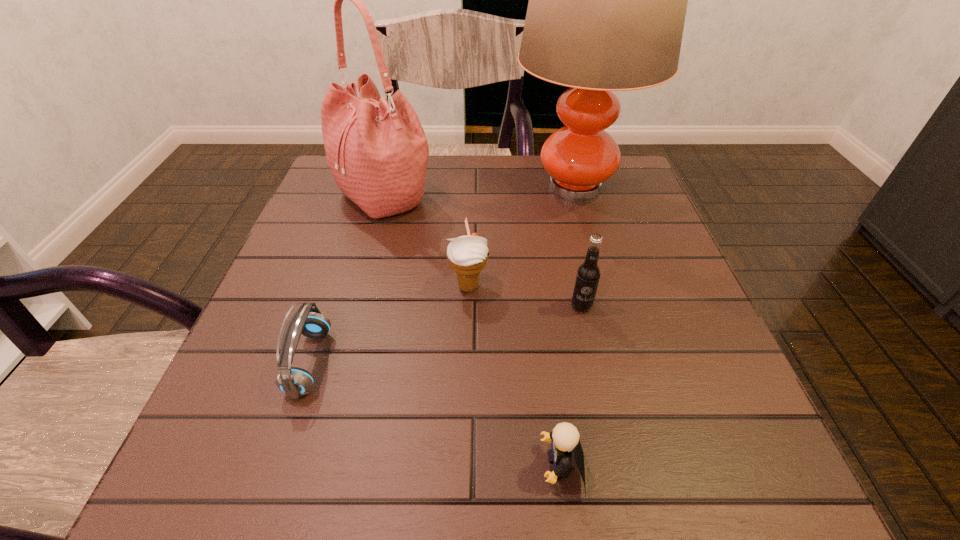
At what (x,y) coordinates should I click in order to perform the action: click on vacant region located 0.220m on the front of the fourth tallest object. Please return your answer as a coordinate pair (x, y). The image size is (960, 540). Looking at the image, I should click on (466, 408).

Locate an element on the screen. The image size is (960, 540). vacant space located 0.090m on the ear cups of the headset is located at coordinates (380, 362).

You are a GUI agent. You are given a task and a screenshot of the screen. Output one action in this format:
    pyautogui.click(x=<x>, y=<y>)
    Task: Click on the vacant point located on the front-facing side of the Lego
    This screenshot has height=540, width=960.
    Given the screenshot: What is the action you would take?
    pyautogui.click(x=490, y=465)

The image size is (960, 540). I want to click on free region located on the front-facing side of the Lego, so click(372, 465).

Where is `blank space located on the front-facing side of the Lego`? The width and height of the screenshot is (960, 540). blank space located on the front-facing side of the Lego is located at coordinates (285, 465).

At what (x,y) coordinates should I click in order to perform the action: click on lamp at the far edge. Please return your answer as a coordinate pair (x, y). The height and width of the screenshot is (540, 960). Looking at the image, I should click on (607, 4).

The image size is (960, 540). I want to click on handbag that is at the far edge, so click(x=377, y=152).

The width and height of the screenshot is (960, 540). I want to click on object present at the near edge, so click(565, 437).

Find the location of a particular element. The width and height of the screenshot is (960, 540). handbag positioned at the left edge is located at coordinates (377, 152).

Identify the location of headset that is at the left edge. (295, 382).